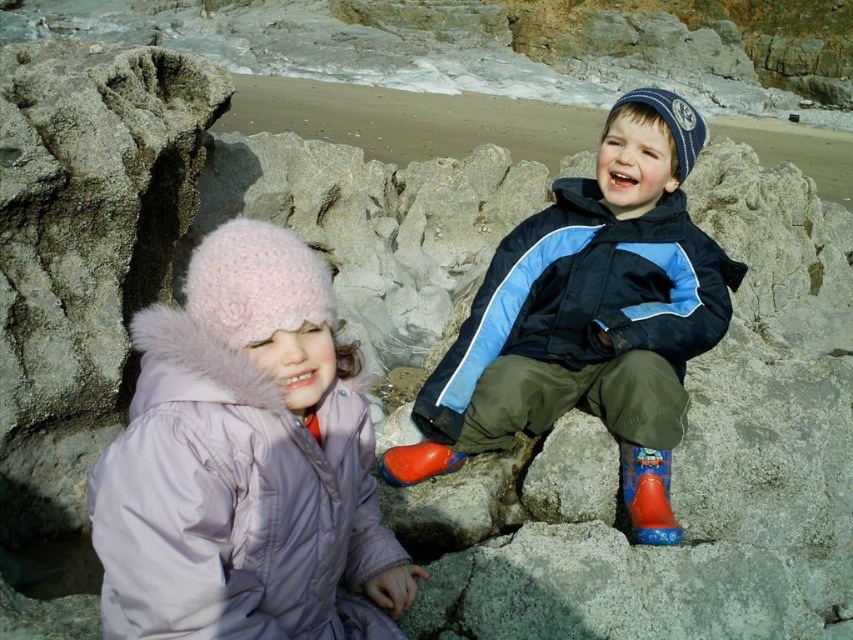
Does matte pink fur-lined coat at left appear on the left side of rubber/matte boot at lower center?

Indeed, matte pink fur-lined coat at left is positioned on the left side of rubber/matte boot at lower center.

Who is more distant from viewer, (206, 362) or (422, 481)?

Point (422, 481)

What do you see at coordinates (244, 461) in the screenshot? Image resolution: width=853 pixels, height=640 pixels. I see `matte pink fur-lined coat at left` at bounding box center [244, 461].

Identify the location of matte pink fur-lined coat at left. (244, 461).

Can you confirm if blue and white jacket at center is bigger than rubber/matte boot at lower center?

Indeed, blue and white jacket at center has a larger size compared to rubber/matte boot at lower center.

Which is above, blue and white jacket at center or rubber/matte boot at lower center?

blue and white jacket at center

Identify the location of blue and white jacket at center. (592, 298).

Can you confirm if matte pink fur-lined coat at left is thinner than blue and white jacket at center?

Indeed, matte pink fur-lined coat at left has a lesser width compared to blue and white jacket at center.

Consider the image. Does matte pink fur-lined coat at left have a greater width compared to blue and white jacket at center?

Incorrect, matte pink fur-lined coat at left's width does not surpass blue and white jacket at center's.

What are the coordinates of `matte pink fur-lined coat at left` in the screenshot? It's located at (244, 461).